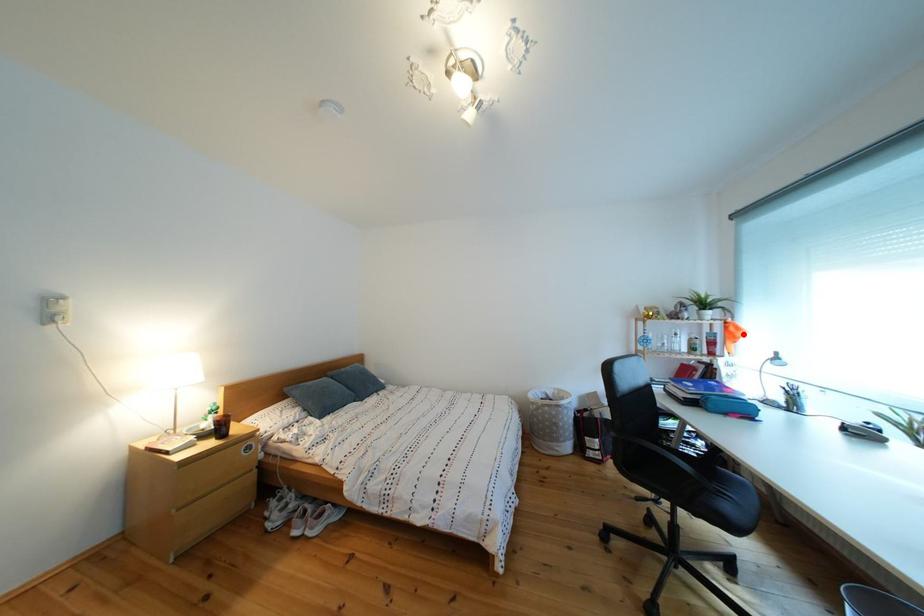
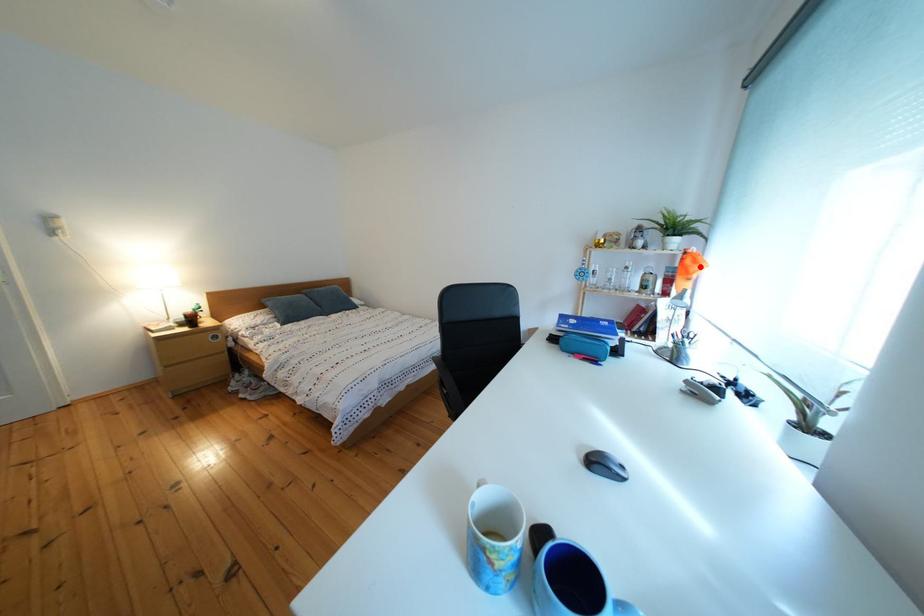
I am providing you with two images of the same scene from different viewpoints. A red point is marked on the first image and another point is marked on the second image. Is the red point in image1 aligned with the point shown in image2?

Yes